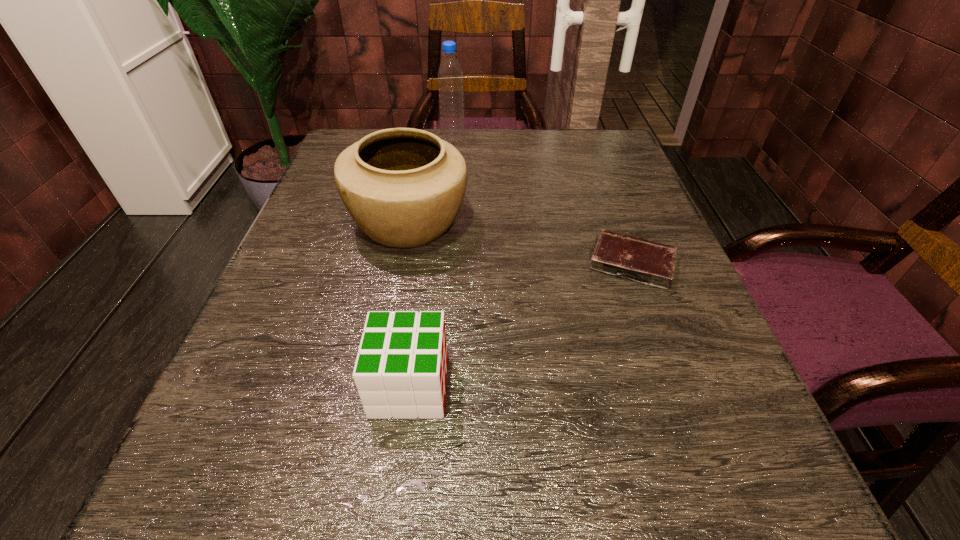
Where is `vacant space located on the back of the shortest object`? This screenshot has height=540, width=960. vacant space located on the back of the shortest object is located at coordinates (594, 159).

Image resolution: width=960 pixels, height=540 pixels. Find the location of `object at the far edge`. object at the far edge is located at coordinates (450, 77).

The image size is (960, 540). What are the coordinates of `object that is at the left edge` in the screenshot? It's located at (403, 187).

Locate an element on the screen. This screenshot has width=960, height=540. object located in the right edge section of the desktop is located at coordinates (644, 261).

Where is `vacant area at the far edge`? The height and width of the screenshot is (540, 960). vacant area at the far edge is located at coordinates (532, 170).

Locate an element on the screen. The height and width of the screenshot is (540, 960). free region at the left edge of the desktop is located at coordinates (317, 265).

You are a GUI agent. You are given a task and a screenshot of the screen. Output one action in this format:
    pyautogui.click(x=<x>, y=<y>)
    Task: Click on the free space at the right edge of the desktop
    The image size is (960, 540).
    Given the screenshot: What is the action you would take?
    pyautogui.click(x=664, y=322)

This screenshot has height=540, width=960. Find the location of `vacant space at the far left corner of the desktop`. vacant space at the far left corner of the desktop is located at coordinates (357, 138).

Locate an element on the screen. vacant space at the near left corner of the desktop is located at coordinates (244, 526).

Where is `free space at the far right corner`? The width and height of the screenshot is (960, 540). free space at the far right corner is located at coordinates tap(587, 139).